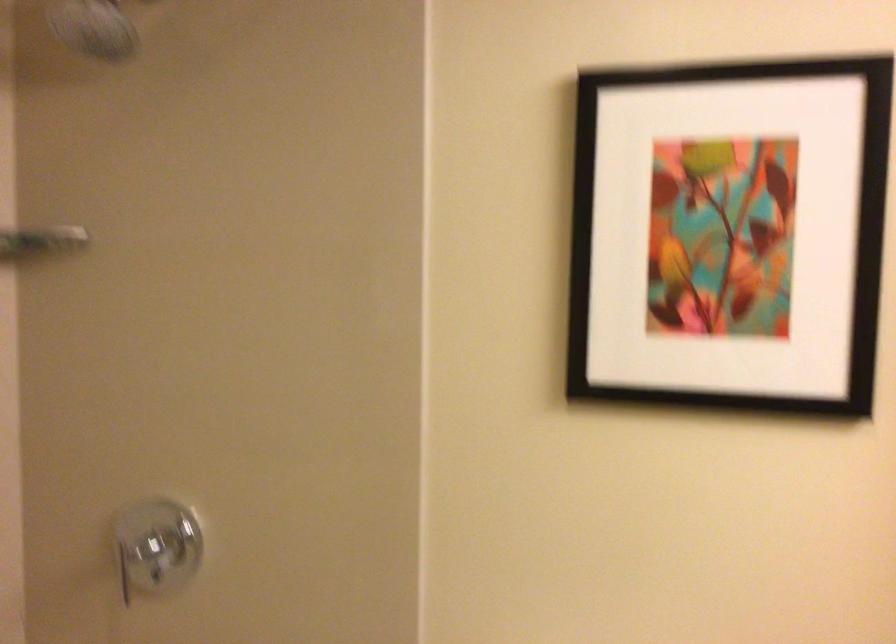
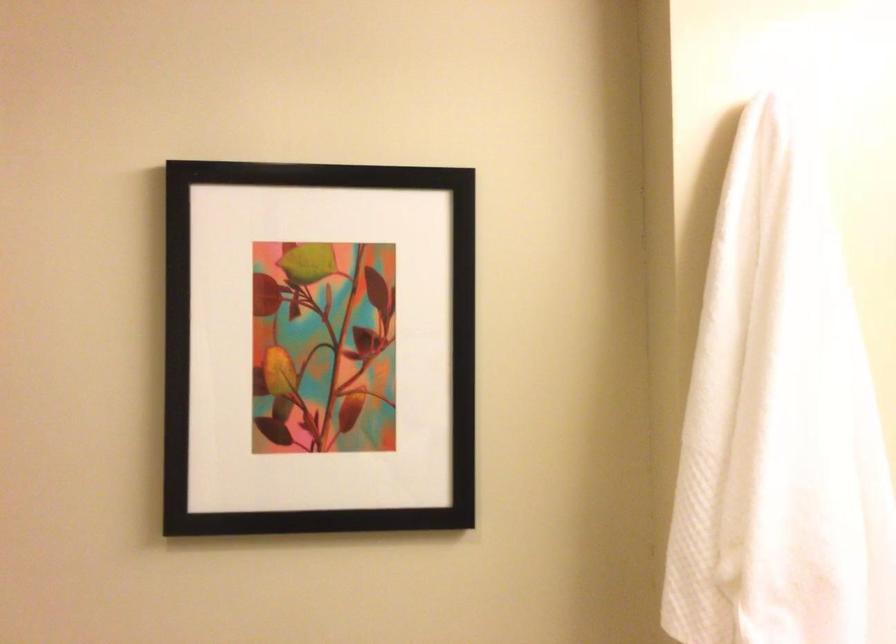
What movement of the cameraman would produce the second image?

The cameraman walked toward right, forward.